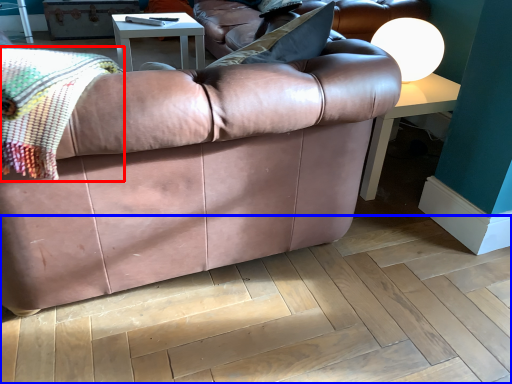
Question: Which object appears closest to the camera in this image, blanket (highlighted by a red box) or plywood (highlighted by a blue box)?

Choices:
 (A) blanket
 (B) plywood

Answer: (A)